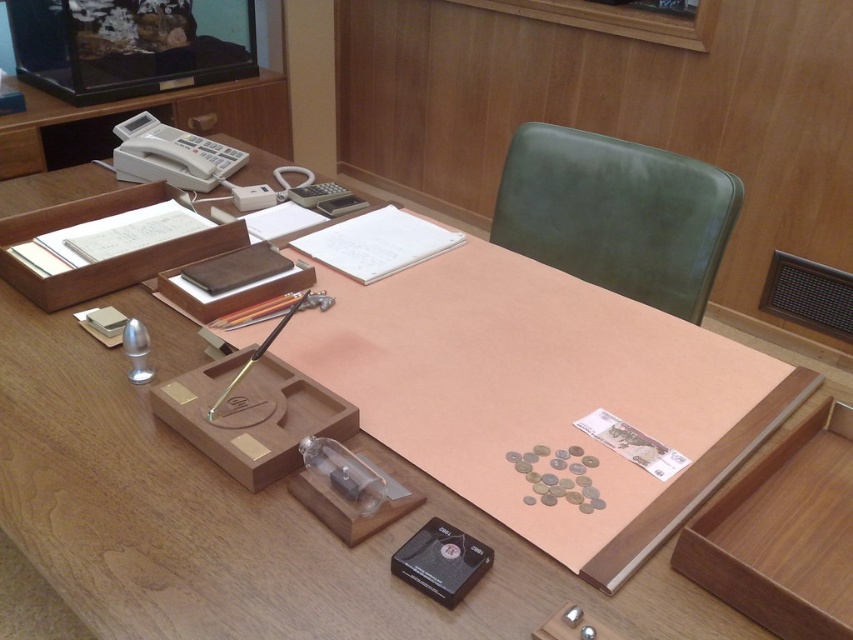
Question: Is the position of wooden pen holder at center-left less distant than that of wooden drawer at lower left?

Choices:
 (A) no
 (B) yes

Answer: (B)

Question: Considering the real-world distances, which object is farthest from the wooden pen at center?

Choices:
 (A) wooden pen holder at center-left
 (B) green leather chair at upper right

Answer: (B)

Question: Based on their relative distances, which object is farther from the black plastic tape at lower center?

Choices:
 (A) wooden pen holder at center-left
 (B) wooden tray at upper left
 (C) white plastic telephone at upper left
 (D) wooden tray at lower right

Answer: (C)

Question: Does green leather chair at upper right appear on the right side of wooden pen at center?

Choices:
 (A) yes
 (B) no

Answer: (A)

Question: Among these points, which one is farthest from the camera?

Choices:
 (A) pyautogui.click(x=3, y=148)
 (B) pyautogui.click(x=804, y=548)

Answer: (A)

Question: From the image, what is the correct spatial relationship of white plastic telephone at upper left in relation to wooden drawer at lower left?

Choices:
 (A) right
 (B) left

Answer: (A)